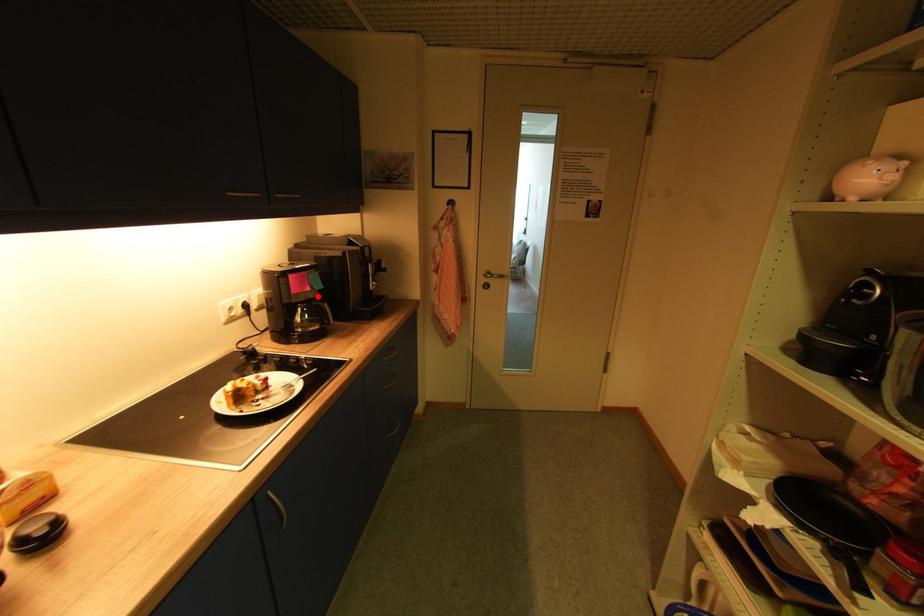
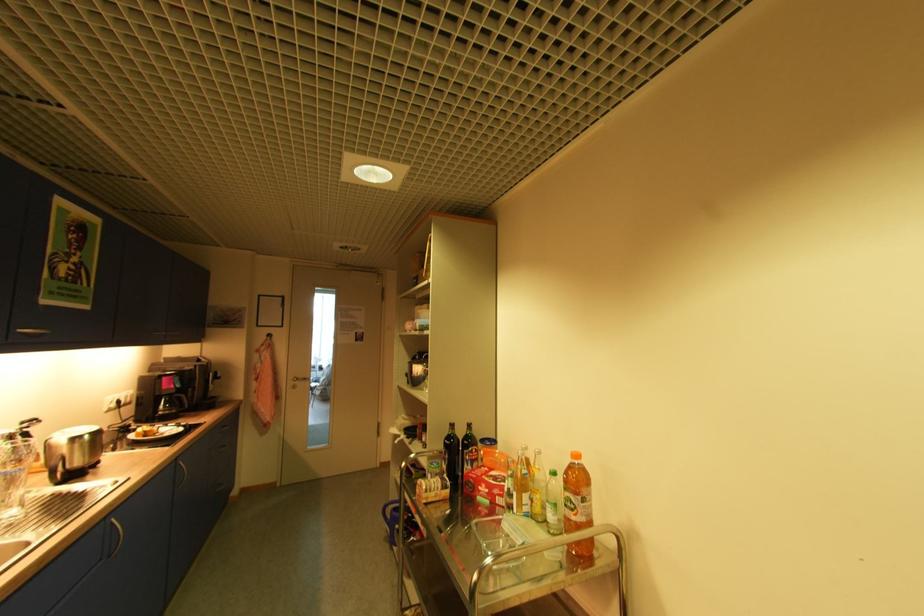
Question: I am providing you with two images of the same scene from different viewpoints. Image1 has a red point marked. In image2, the corresponding 3D location appears at what relative position? Reply with the corresponding letter.

Choices:
 (A) Closer
 (B) Farther

Answer: (B)